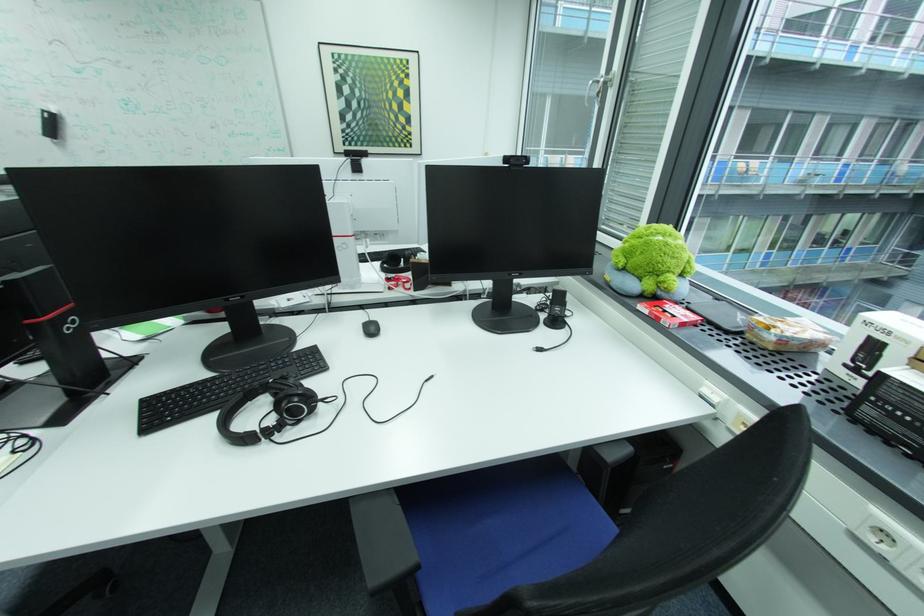
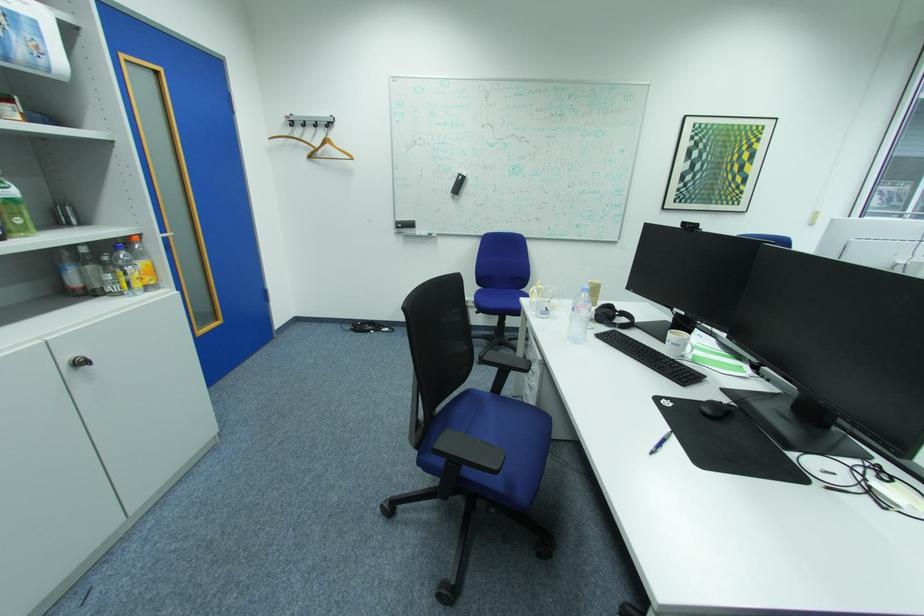
Question: In a continuous first-person perspective shot, in which direction is the camera moving?

Choices:
 (A) Left
 (B) Right
 (C) Forward
 (D) Backward

Answer: (A)